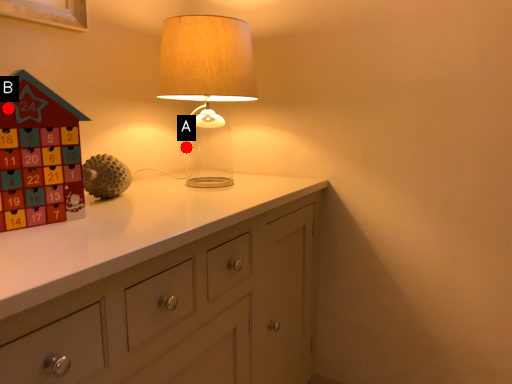
Question: Two points are circled on the image, labeled by A and B beside each circle. Which point appears farthest from the camera in this image?

Choices:
 (A) A is further
 (B) B is further

Answer: (A)